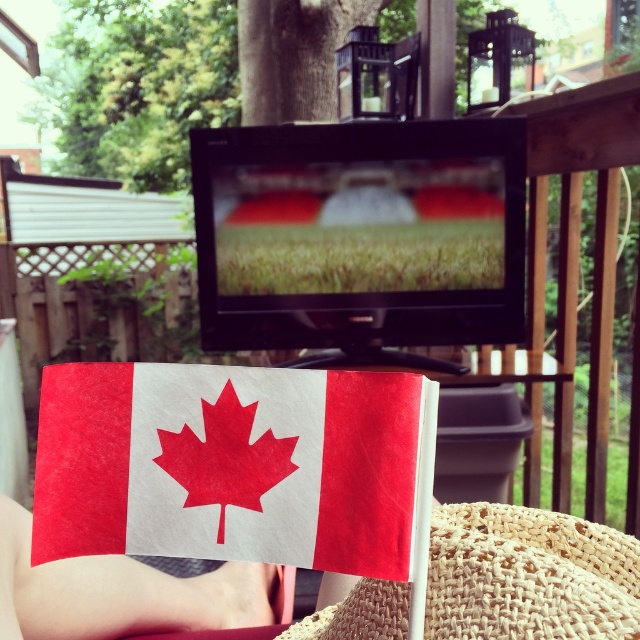
You are holding a 12 inch long pole and want to point it towards the point at coordinate point (x=64, y=433). Can you reach that point with your pole?

The distance of point (x=64, y=433) from camera is 15.72 inches. Since the pole is only 12 inches long, you cannot reach the point with the pole.

You are sitting on a patio chair and want to grab the white paper canadian flag at center. However, there is a woven straw hat at lower center in the way. Can you reach the flag without moving the hat?

The woven straw hat at lower center is closer to the viewer than the white paper canadian flag at center, so you would need to move the hat to reach the flag.